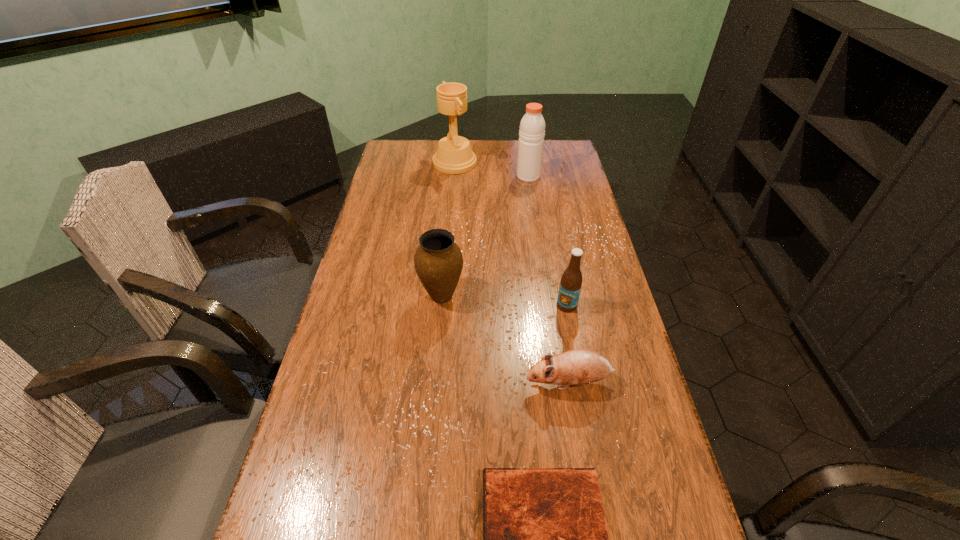
Locate an element on the screen. This screenshot has height=540, width=960. the second closest object relative to the shaker is located at coordinates (438, 261).